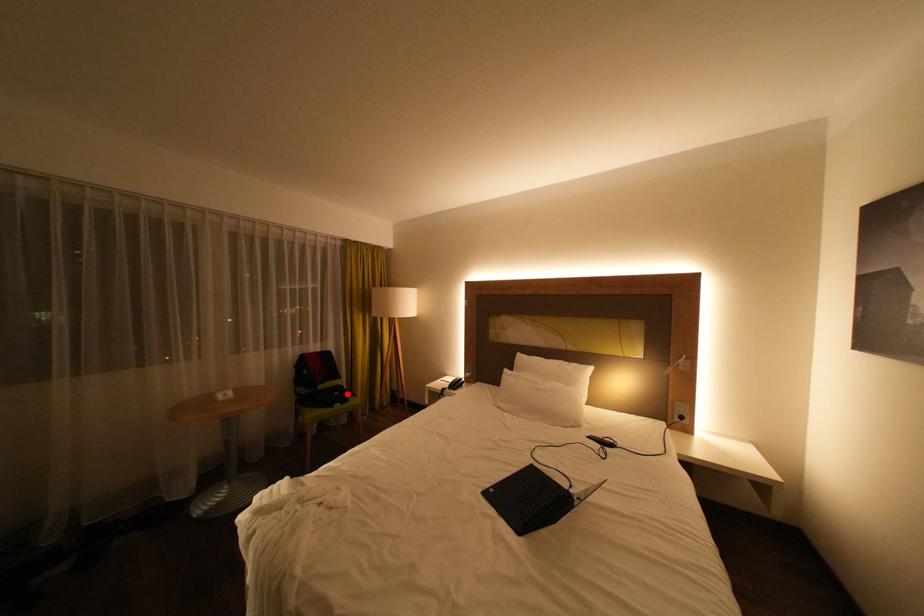
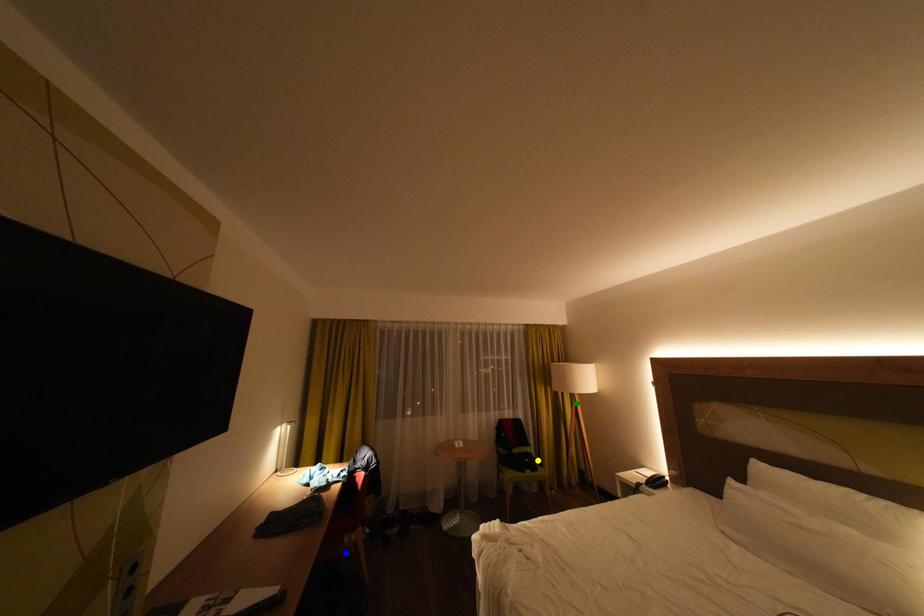
Question: I am providing you with two images of the same scene from different viewpoints. A red point is marked on the first image. You are given multiple points on the second image. Which point in image 2 represents the same 3d spot as the red point in image 1?

Choices:
 (A) green point
 (B) yellow point
 (C) blue point

Answer: (B)